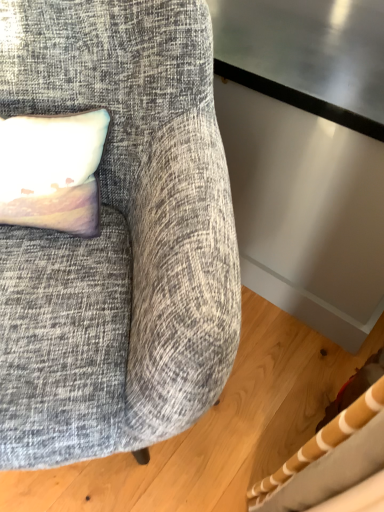
Question: From the image's perspective, is textured gray fabric chair at upper left over pastel fabric pillow at upper left?

Choices:
 (A) no
 (B) yes

Answer: (A)

Question: Does textured gray fabric chair at upper left lie in front of pastel fabric pillow at upper left?

Choices:
 (A) no
 (B) yes

Answer: (B)

Question: From the image's perspective, would you say textured gray fabric chair at upper left is shown under pastel fabric pillow at upper left?

Choices:
 (A) yes
 (B) no

Answer: (A)

Question: Does textured gray fabric chair at upper left come behind pastel fabric pillow at upper left?

Choices:
 (A) yes
 (B) no

Answer: (B)

Question: Considering the relative positions of textured gray fabric chair at upper left and pastel fabric pillow at upper left in the image provided, is textured gray fabric chair at upper left to the left of pastel fabric pillow at upper left from the viewer's perspective?

Choices:
 (A) yes
 (B) no

Answer: (B)

Question: Is textured gray fabric chair at upper left oriented towards pastel fabric pillow at upper left?

Choices:
 (A) no
 (B) yes

Answer: (B)

Question: From the image's perspective, is pastel fabric pillow at upper left on textured gray fabric chair at upper left?

Choices:
 (A) no
 (B) yes

Answer: (B)

Question: From the image's perspective, is pastel fabric pillow at upper left located beneath textured gray fabric chair at upper left?

Choices:
 (A) no
 (B) yes

Answer: (A)

Question: Is pastel fabric pillow at upper left facing towards textured gray fabric chair at upper left?

Choices:
 (A) no
 (B) yes

Answer: (B)

Question: From a real-world perspective, is pastel fabric pillow at upper left on top of textured gray fabric chair at upper left?

Choices:
 (A) yes
 (B) no

Answer: (A)

Question: Is pastel fabric pillow at upper left positioned with its back to textured gray fabric chair at upper left?

Choices:
 (A) yes
 (B) no

Answer: (A)

Question: Is pastel fabric pillow at upper left not close to textured gray fabric chair at upper left?

Choices:
 (A) yes
 (B) no

Answer: (B)

Question: From a real-world perspective, is pastel fabric pillow at upper left physically located above or below textured gray fabric chair at upper left?

Choices:
 (A) below
 (B) above

Answer: (B)